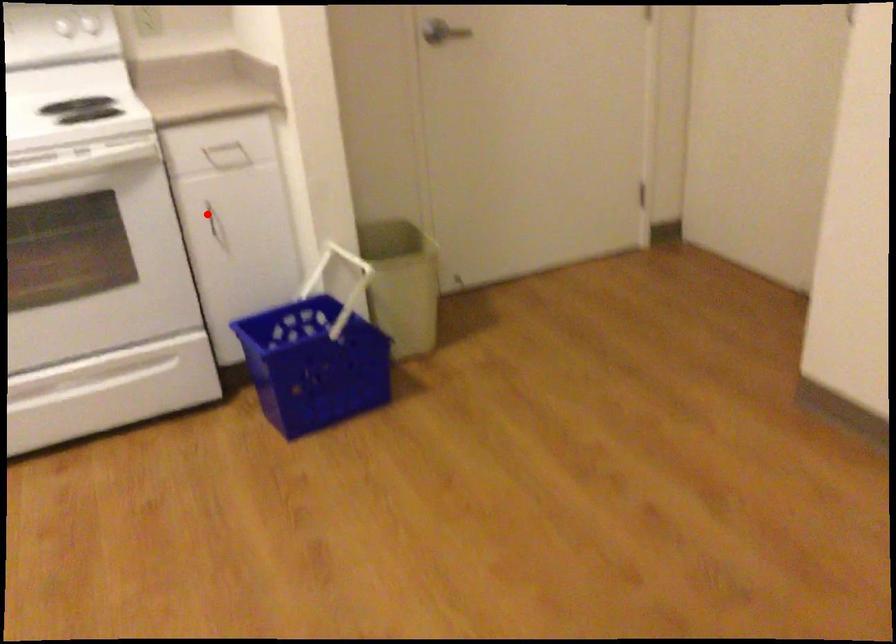
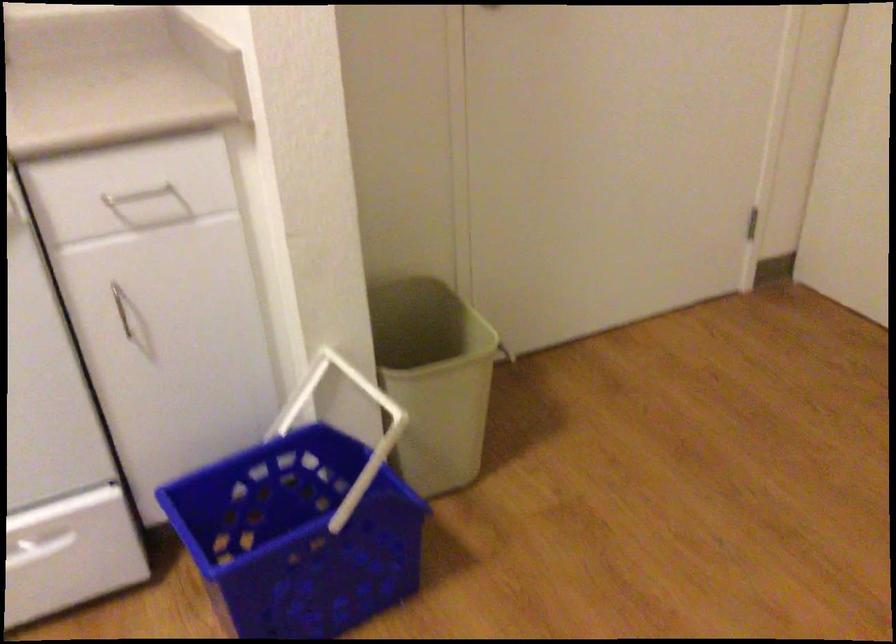
Question: I am providing you with two images of the same scene from different viewpoints. A red point is shown in image1. For the corresponding object point in image2, is it positioned nearer or farther from the camera?

Choices:
 (A) Nearer
 (B) Farther

Answer: (A)